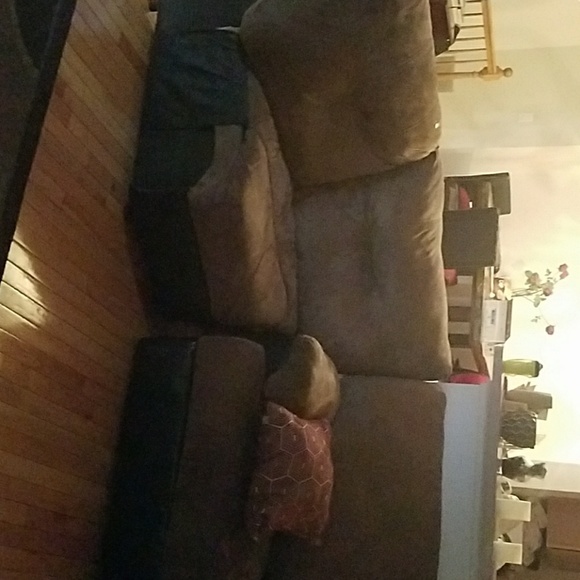
Identify the location of wall. The height and width of the screenshot is (580, 580). (566, 240), (538, 78).